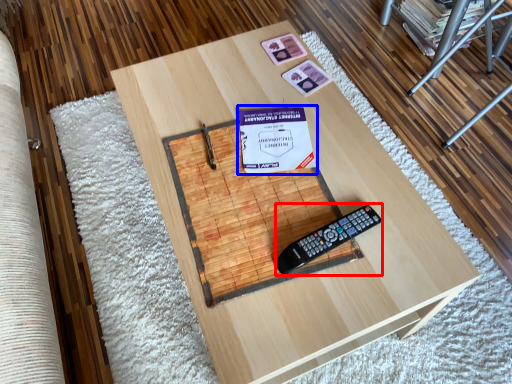
Question: Which point is closer to the camera, equipment (highlighted by a red box) or paperback book (highlighted by a blue box)?

Choices:
 (A) equipment
 (B) paperback book

Answer: (A)